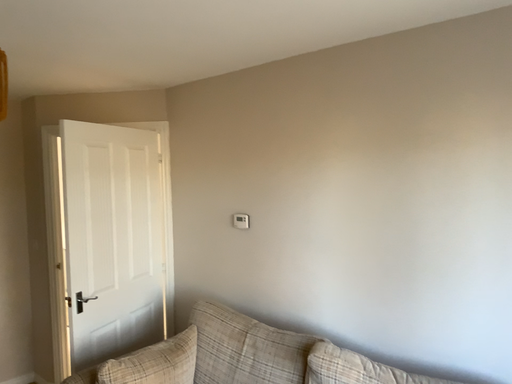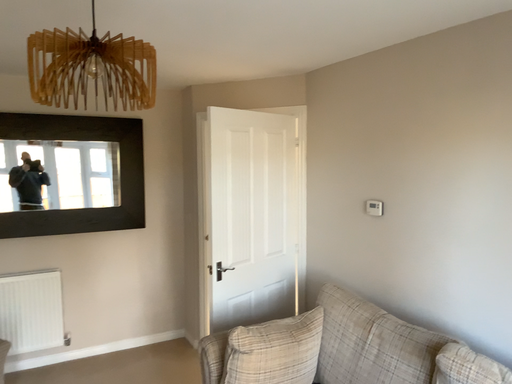
Question: Which way did the camera rotate in the video?

Choices:
 (A) rotated right
 (B) rotated left

Answer: (B)